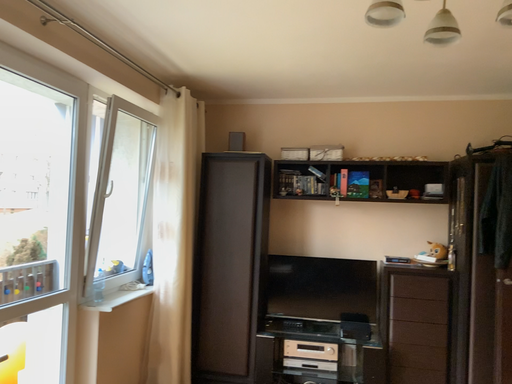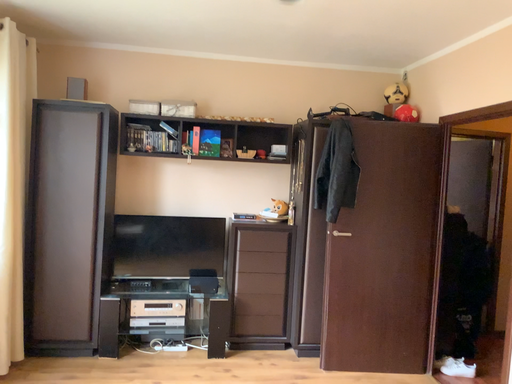
Question: How did the camera likely rotate when shooting the video?

Choices:
 (A) rotated right
 (B) rotated left

Answer: (A)